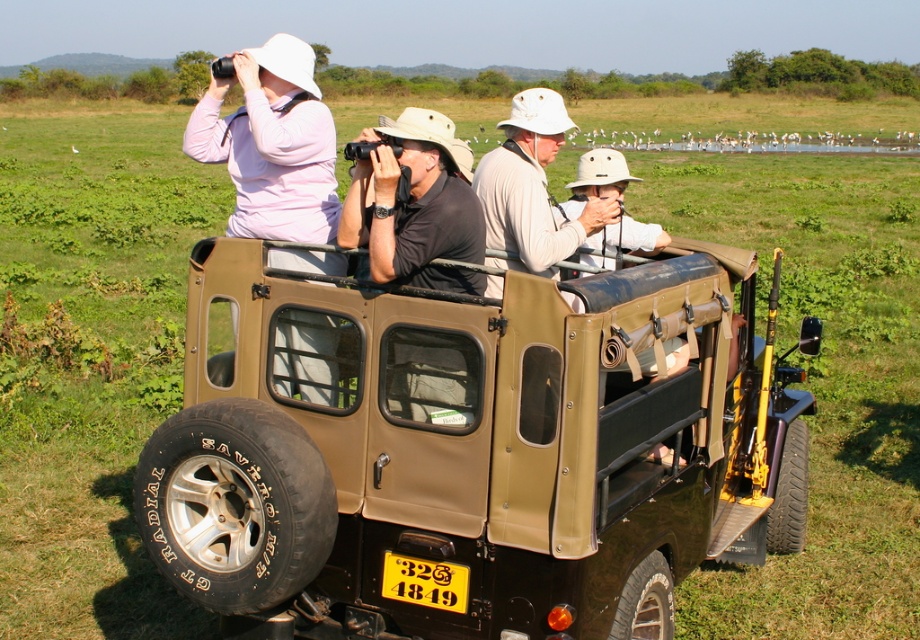
Is matte khaki jeep at center taller than matte pink sweater at upper left?

Incorrect, matte khaki jeep at center's height is not larger of matte pink sweater at upper left's.

Is point (813, 342) positioned before point (259, 49)?

Yes, point (813, 342) is closer to viewer.

Between point (332, 292) and point (270, 109), which one is positioned behind?

Positioned behind is point (270, 109).

This screenshot has height=640, width=920. Find the location of `matte khaki jeep at center`. matte khaki jeep at center is located at coordinates (467, 448).

Between matte pink sweater at upper left and yellow matte license plate at rear, which one appears on the left side from the viewer's perspective?

matte pink sweater at upper left is more to the left.

Can you confirm if matte pink sweater at upper left is positioned to the right of yellow matte license plate at rear?

No, matte pink sweater at upper left is not to the right of yellow matte license plate at rear.

Who is more distant from viewer, (295, 209) or (412, 564)?

The point (295, 209) is more distant.

You are a GUI agent. You are given a task and a screenshot of the screen. Output one action in this format:
    pyautogui.click(x=<x>, y=<y>)
    Task: Click on the matte pink sweater at upper left
    This screenshot has height=640, width=920.
    Given the screenshot: What is the action you would take?
    pyautogui.click(x=272, y=144)

Looking at this image, who is more distant from viewer, (443,154) or (441,588)?

Point (443,154)

Is matte black shirt at center above yellow matte license plate at rear?

Correct, matte black shirt at center is located above yellow matte license plate at rear.

Is point (479, 282) positioned before point (439, 572)?

No.

Where is `matte black shirt at center`? matte black shirt at center is located at coordinates (414, 205).